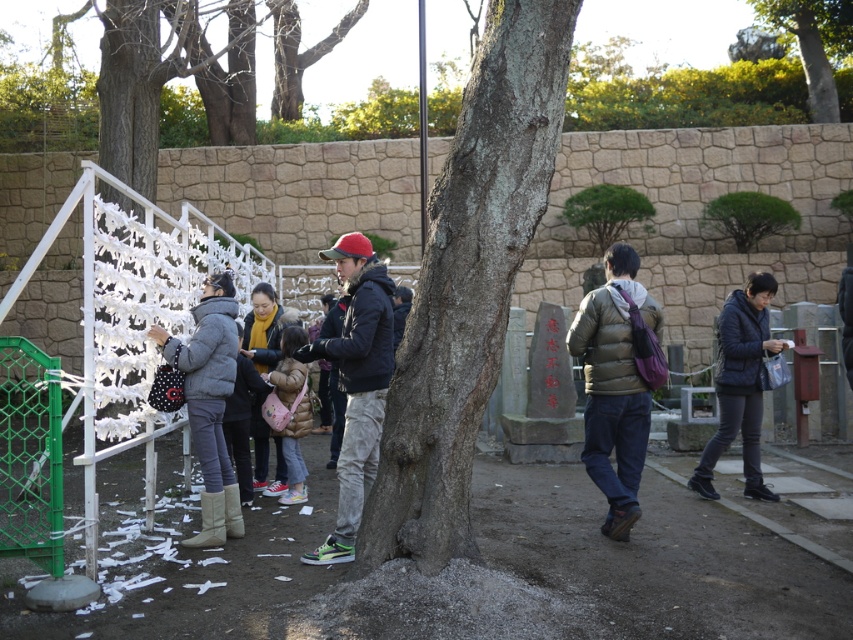
You are a delivery person standing at the park entrance. You need to place a dark blue jacket at center and a matte pink fabric bag at center on the ground. The park has a rule that items must be at least 5 feet apart. Can you place them according to the rule?

The distance between the dark blue jacket at center and the matte pink fabric bag at center is 5.60 feet, which is more than the required 5 feet. Therefore, they can be placed according to the park rule.